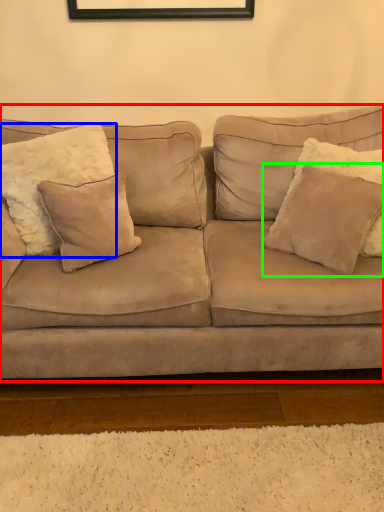
Question: Considering the real-world distances, which object is farthest from studio couch (highlighted by a red box)? pillow (highlighted by a blue box) or pillow (highlighted by a green box)?

Choices:
 (A) pillow
 (B) pillow

Answer: (A)